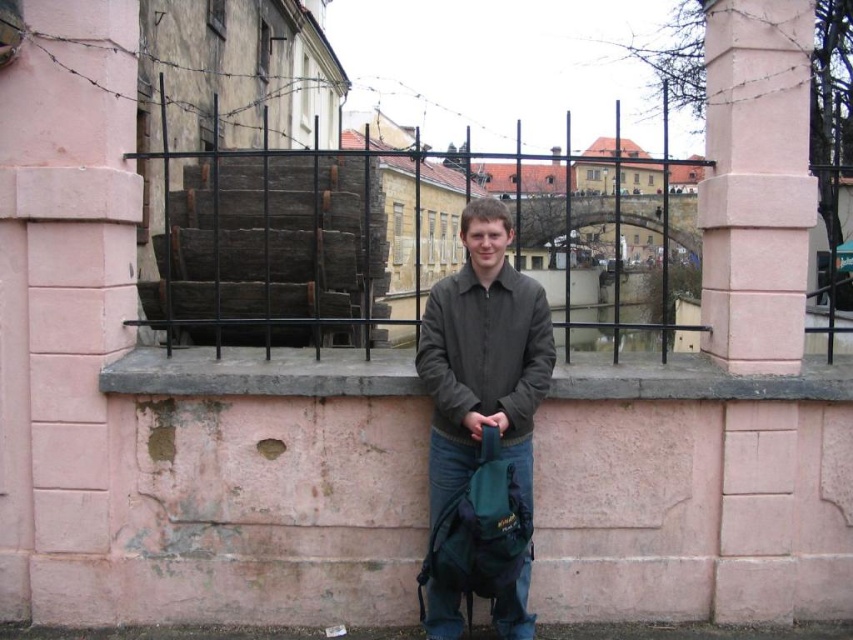
Question: Which point is farther from the camera taking this photo?

Choices:
 (A) (786, 308)
 (B) (654, 396)
 (C) (183, 157)
 (D) (505, 282)

Answer: (C)

Question: Which point is closer to the camera?

Choices:
 (A) pink stone pillar at center right
 (B) black metal fence at center
 (C) pink concrete ledge at center
 (D) dark gray fabric jacket at center

Answer: (D)

Question: Which object is positioned farthest from the pink stone pillar at center right?

Choices:
 (A) black metal fence at center
 (B) dark gray fabric jacket at center

Answer: (A)

Question: Is pink concrete ledge at center closer to camera compared to black metal fence at center?

Choices:
 (A) no
 (B) yes

Answer: (B)

Question: Is pink concrete ledge at center above black metal fence at center?

Choices:
 (A) yes
 (B) no

Answer: (B)

Question: Is dark gray fabric jacket at center thinner than black metal fence at center?

Choices:
 (A) yes
 (B) no

Answer: (A)